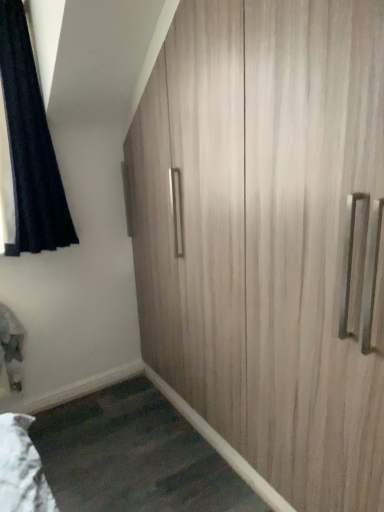
Question: Does light wood cupboard at center appear on the left side of black velvet curtain at upper left?

Choices:
 (A) no
 (B) yes

Answer: (A)

Question: Is light wood cupboard at center at the right side of black velvet curtain at upper left?

Choices:
 (A) yes
 (B) no

Answer: (A)

Question: From a real-world perspective, is light wood cupboard at center on black velvet curtain at upper left?

Choices:
 (A) no
 (B) yes

Answer: (A)

Question: Does light wood cupboard at center have a larger size compared to black velvet curtain at upper left?

Choices:
 (A) yes
 (B) no

Answer: (A)

Question: From a real-world perspective, is light wood cupboard at center positioned under black velvet curtain at upper left based on gravity?

Choices:
 (A) yes
 (B) no

Answer: (A)

Question: Can you confirm if light wood cupboard at center is taller than black velvet curtain at upper left?

Choices:
 (A) no
 (B) yes

Answer: (B)

Question: Is black velvet curtain at upper left shorter than light wood cupboard at center?

Choices:
 (A) yes
 (B) no

Answer: (A)

Question: Is black velvet curtain at upper left aimed at light wood cupboard at center?

Choices:
 (A) no
 (B) yes

Answer: (A)

Question: Does black velvet curtain at upper left appear on the left side of light wood cupboard at center?

Choices:
 (A) no
 (B) yes

Answer: (B)

Question: Is black velvet curtain at upper left oriented away from light wood cupboard at center?

Choices:
 (A) yes
 (B) no

Answer: (B)

Question: From the image's perspective, is black velvet curtain at upper left located above light wood cupboard at center?

Choices:
 (A) yes
 (B) no

Answer: (A)

Question: Is black velvet curtain at upper left surrounding light wood cupboard at center?

Choices:
 (A) no
 (B) yes

Answer: (A)

Question: From the image's perspective, relative to light wood cupboard at center, is black velvet curtain at upper left above or below?

Choices:
 (A) below
 (B) above

Answer: (B)